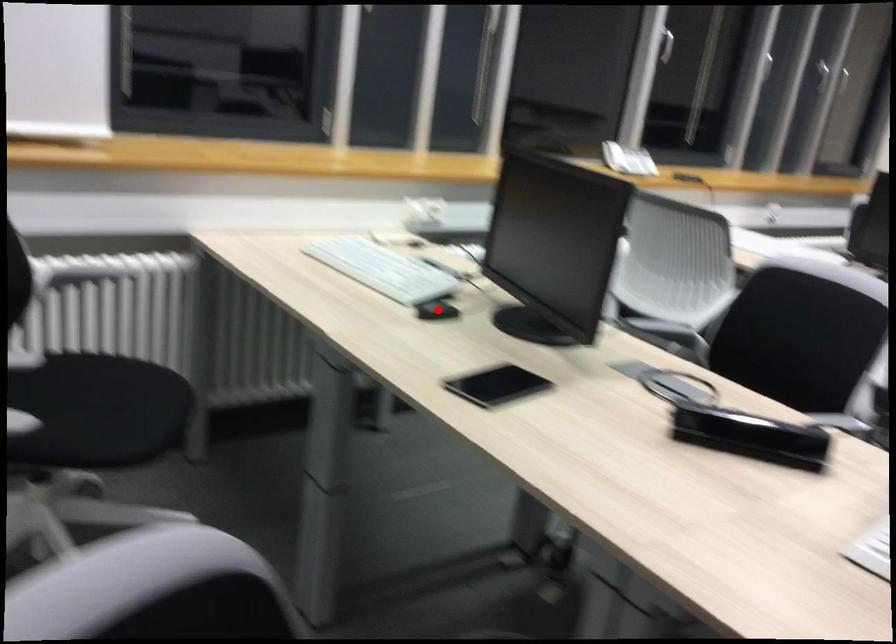
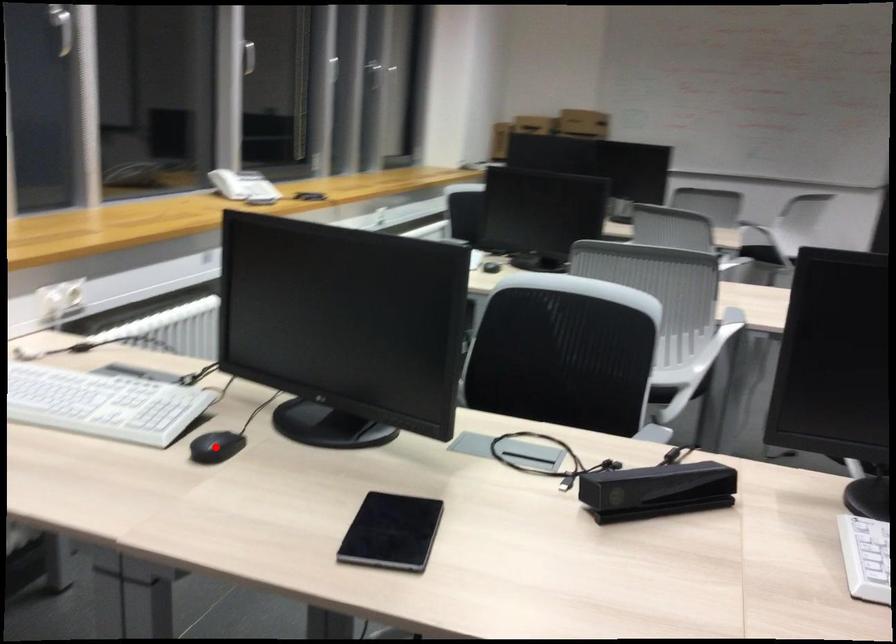
I am providing you with two images of the same scene from different viewpoints. A red point is marked on the first image and another point is marked on the second image. Is the marked point in image1 the same physical position as the marked point in image2?

Yes